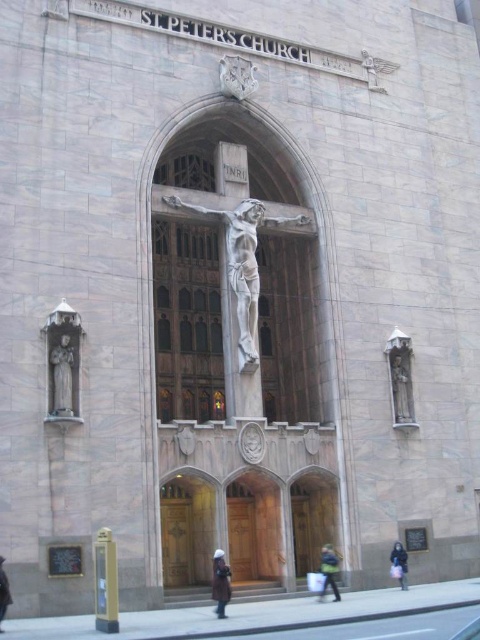
Question: Considering the relative positions of polished bronze crucifix at center and polished stone statue at right in the image provided, where is polished bronze crucifix at center located with respect to polished stone statue at right?

Choices:
 (A) above
 (B) below

Answer: (A)

Question: Is polished bronze crucifix at center to the right of dark brown leather coat at center from the viewer's perspective?

Choices:
 (A) no
 (B) yes

Answer: (B)

Question: Which object is the closest to the dark brown leather coat at center?

Choices:
 (A) polished bronze crucifix at center
 (B) brown wooden door at center
 (C) dark blue coat at lower right

Answer: (B)

Question: Which object is positioned farthest from the green fabric bag at lower center?

Choices:
 (A) dark blue coat at lower right
 (B) polished bronze crucifix at center
 (C) polished stone angel at right

Answer: (B)

Question: Does polished stone angel at right come behind dark blue coat at lower right?

Choices:
 (A) no
 (B) yes

Answer: (B)

Question: Which of the following is the farthest from the observer?

Choices:
 (A) dark brown leather coat at center
 (B) green fabric bag at lower center
 (C) brown wooden door at center
 (D) polished bronze crucifix at center

Answer: (D)